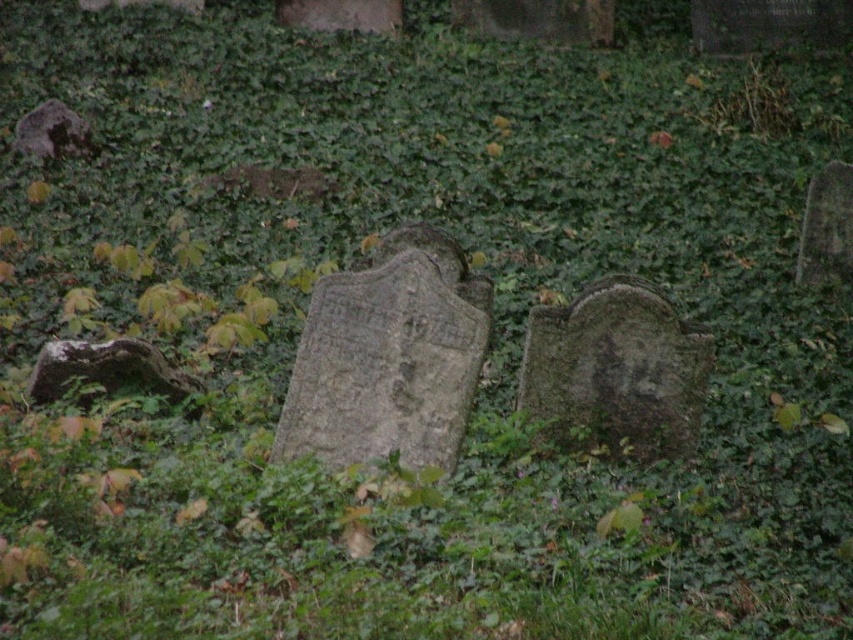
You are a gardener trying to clear overgrowth from the cemetery. You need to know which stone is taller to prioritize which area to work on first. Which stone is taller between the gray stone at right and the rough gray stone at upper left?

The gray stone at right has a greater height compared to the rough gray stone at upper left, so the gray stone at right is taller.

You are a gardener trying to clear a path between the green mossy gravestone at center and the rusty stone at left. Based on their sizes, which stone will require more space to work around?

The green mossy gravestone at center might be wider than rusty stone at left, so it will likely require more space to work around.